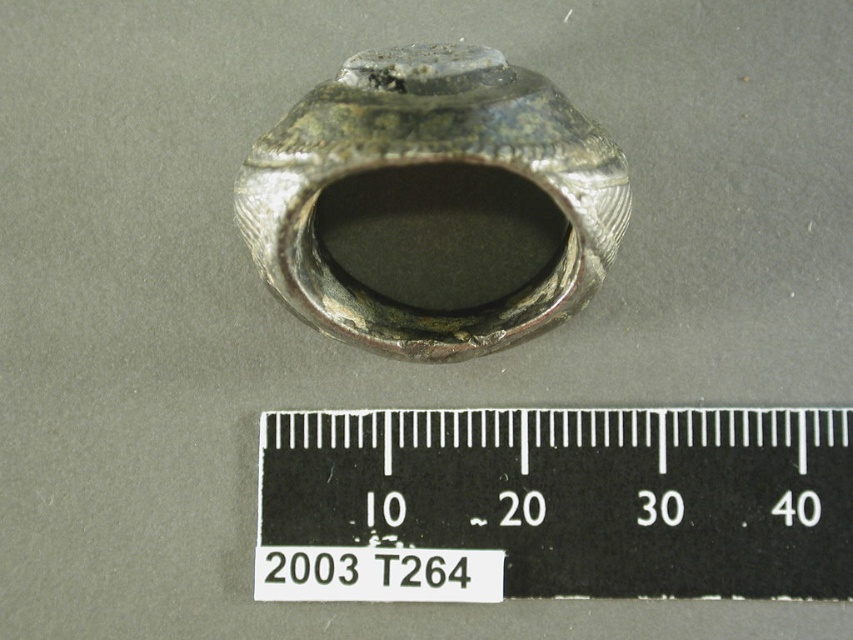
In the scene shown: Does black plastic ruler at center have a lesser height compared to silver metallic ring at center?

Indeed, black plastic ruler at center has a lesser height compared to silver metallic ring at center.

You are a GUI agent. You are given a task and a screenshot of the screen. Output one action in this format:
    pyautogui.click(x=<x>, y=<y>)
    Task: Click on the black plastic ruler at center
    This screenshot has height=640, width=853.
    Given the screenshot: What is the action you would take?
    pyautogui.click(x=554, y=504)